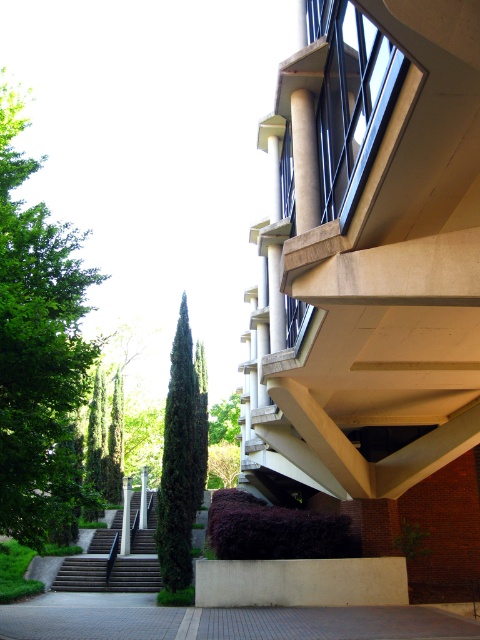
Question: Which is nearer to the green textured tree at center?

Choices:
 (A) wooden stairs at center
 (B) green concrete pillar at center
 (C) white concrete pillar at center

Answer: (C)

Question: Is green leafy tree at left closer to camera compared to wooden stairs at center?

Choices:
 (A) no
 (B) yes

Answer: (B)

Question: Which object is positioned closest to the green textured tree at center?

Choices:
 (A) white concrete pillar at center
 (B) gray brick pavement at lower center
 (C) green leafy tree at left
 (D) green concrete pillar at center

Answer: (B)

Question: Can you confirm if gray brick pavement at lower center is positioned to the left of white concrete pillar at center?

Choices:
 (A) yes
 (B) no

Answer: (B)

Question: Does gray brick pavement at lower center come behind wooden stairs at center?

Choices:
 (A) no
 (B) yes

Answer: (A)

Question: Which point appears farthest from the camera in this image?

Choices:
 (A) (197, 499)
 (B) (48, 449)
 (C) (128, 540)

Answer: (A)